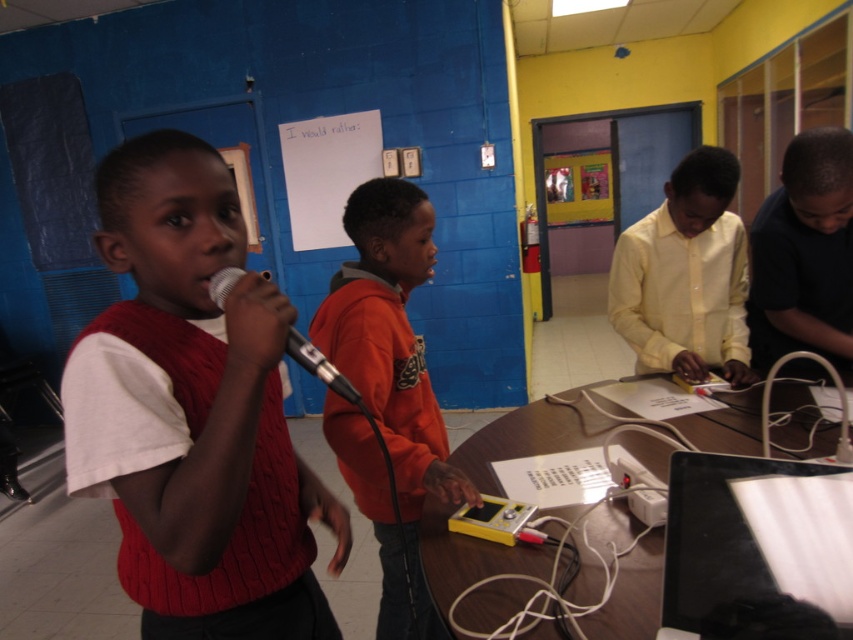
Can you confirm if cable-knit sweater at left is shorter than black matte shirt at right?

In fact, cable-knit sweater at left may be taller than black matte shirt at right.

Which is in front, point (178, 132) or point (790, 202)?

Positioned in front is point (178, 132).

Which is behind, point (144, 362) or point (802, 298)?

Positioned behind is point (802, 298).

The width and height of the screenshot is (853, 640). I want to click on cable-knit sweater at left, so click(194, 412).

Is cable-knit sweater at left taller than silver metallic microphone at center?

Yes, cable-knit sweater at left is taller than silver metallic microphone at center.

Locate an element on the screen. cable-knit sweater at left is located at coordinates (194, 412).

Where is `cable-knit sweater at left`? cable-knit sweater at left is located at coordinates (194, 412).

Is cable-knit sweater at left positioned behind orange fleece hoodie at center?

No.

Can you confirm if cable-knit sweater at left is smaller than orange fleece hoodie at center?

Correct, cable-knit sweater at left occupies less space than orange fleece hoodie at center.

Identify the location of cable-knit sweater at left. (194, 412).